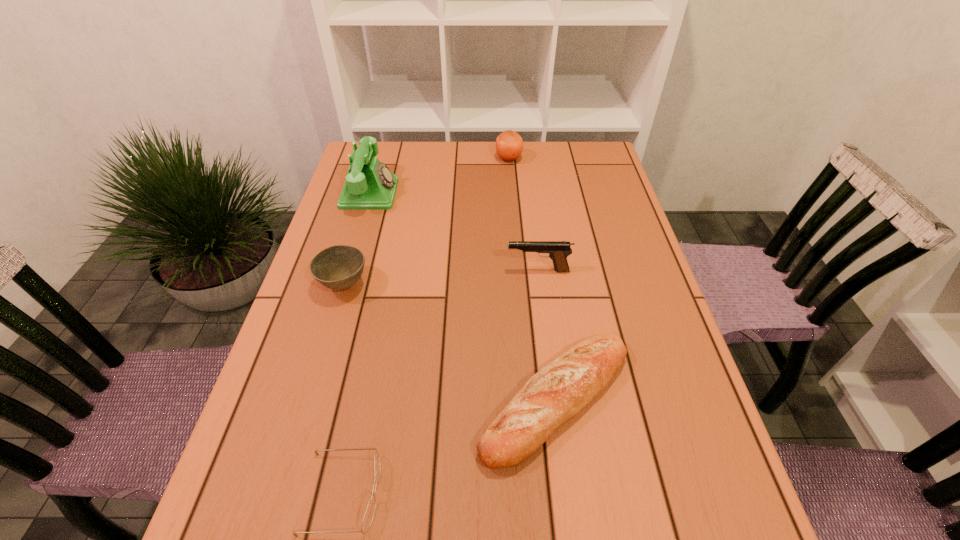
Find the location of a particular element. spectacles at the left edge is located at coordinates (369, 514).

Where is `object positioned at the right edge`? This screenshot has height=540, width=960. object positioned at the right edge is located at coordinates (558, 392).

This screenshot has height=540, width=960. Find the location of `object situated at the far left corner`. object situated at the far left corner is located at coordinates (370, 185).

Find the location of `object at the near left corner`. object at the near left corner is located at coordinates (369, 514).

I want to click on vacant space at the far edge of the desktop, so click(x=427, y=144).

In the image, there is a desktop. At what (x,y) coordinates should I click in order to perform the action: click on free space at the near edge. Please return your answer as a coordinate pair (x, y). Image resolution: width=960 pixels, height=540 pixels. Looking at the image, I should click on (609, 537).

Where is `vacant space at the left edge`? This screenshot has width=960, height=540. vacant space at the left edge is located at coordinates (341, 392).

Identify the location of blank space at the right edge. This screenshot has height=540, width=960. (640, 370).

This screenshot has height=540, width=960. Find the location of `free spot between the shortest object and the baguet`. free spot between the shortest object and the baguet is located at coordinates (449, 447).

Where is `vacant region between the pistol and the bowl`? The width and height of the screenshot is (960, 540). vacant region between the pistol and the bowl is located at coordinates (441, 278).